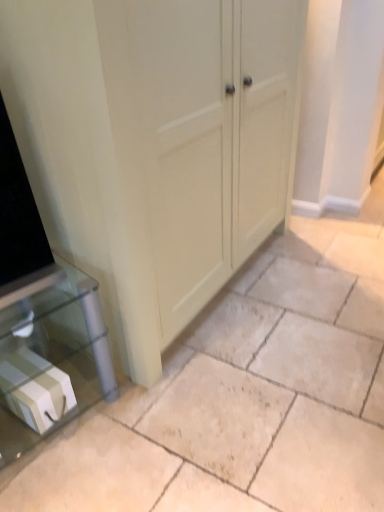
Question: In the image, is beige tile floor at center on the left side or the right side of matte cream cupboard at center?

Choices:
 (A) left
 (B) right

Answer: (B)

Question: Is beige tile floor at center inside the boundaries of matte cream cupboard at center, or outside?

Choices:
 (A) inside
 (B) outside

Answer: (B)

Question: Based on their relative distances, which object is farther from the white glossy box at lower left?

Choices:
 (A) beige tile floor at center
 (B) matte cream cupboard at center

Answer: (B)

Question: Which of these objects is positioned farthest from the beige tile floor at center?

Choices:
 (A) white glossy box at lower left
 (B) matte cream cupboard at center

Answer: (B)